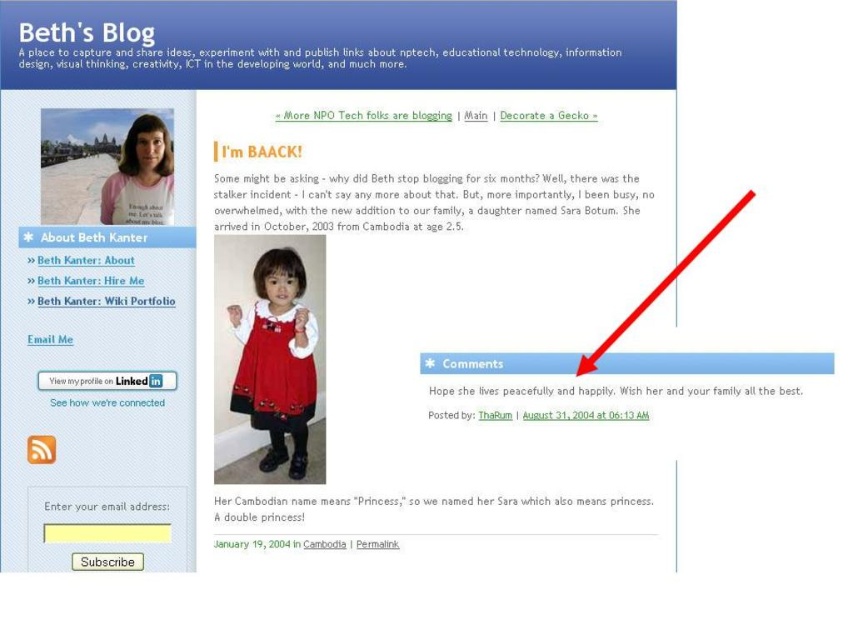
Question: Which object is closer to the camera taking this photo?

Choices:
 (A) red velvet dress at center
 (B) matte white dress at upper left

Answer: (B)

Question: Among these objects, which one is farthest from the camera?

Choices:
 (A) matte white dress at upper left
 (B) red velvet dress at center

Answer: (B)

Question: Does red velvet dress at center appear on the right side of matte white dress at upper left?

Choices:
 (A) yes
 (B) no

Answer: (A)

Question: Which object appears closest to the camera in this image?

Choices:
 (A) red velvet dress at center
 (B) matte white dress at upper left

Answer: (B)

Question: Can you confirm if red velvet dress at center is bigger than matte white dress at upper left?

Choices:
 (A) no
 (B) yes

Answer: (B)

Question: Is red velvet dress at center below matte white dress at upper left?

Choices:
 (A) no
 (B) yes

Answer: (B)